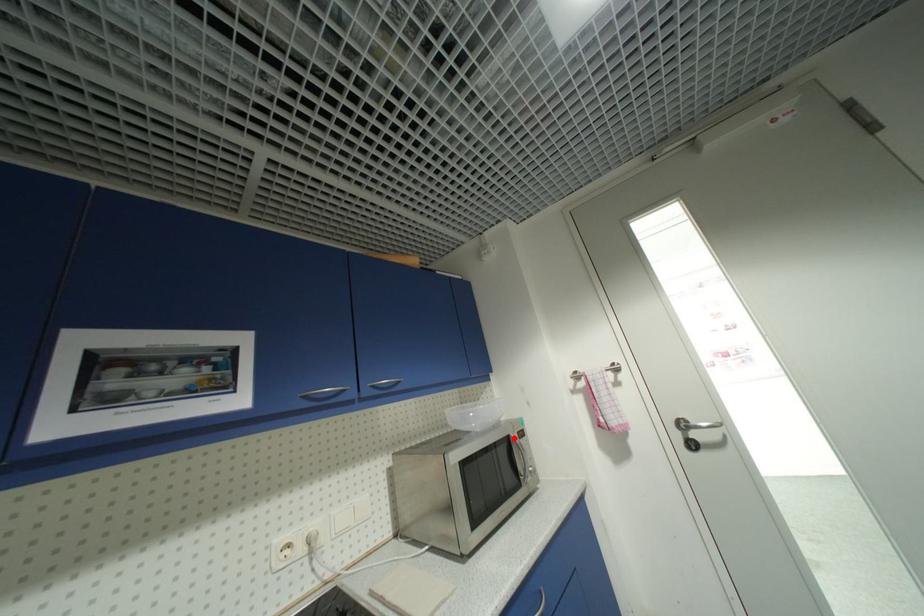
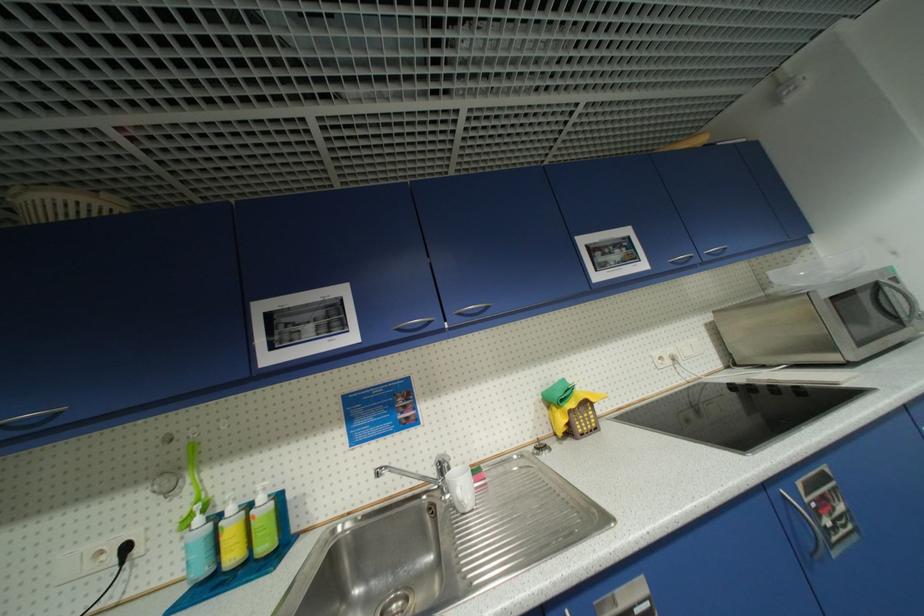
The point at the highlighted location is marked in the first image. Where is the corresponding point in the second image?

(883, 284)